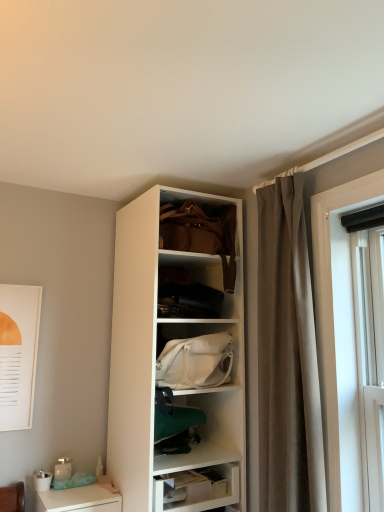
Question: Are white glossy desk at lower left and white fabric handbag at center, arranged as the 2th handbag when viewed from the top, located far from each other?

Choices:
 (A) no
 (B) yes

Answer: (A)

Question: Is white glossy desk at lower left positioned in front of white fabric handbag at center, arranged as the 2th handbag when viewed from the top?

Choices:
 (A) no
 (B) yes

Answer: (A)

Question: Is white glossy desk at lower left oriented towards white fabric handbag at center, the first handbag from the bottom?

Choices:
 (A) yes
 (B) no

Answer: (B)

Question: Considering the relative sizes of white glossy desk at lower left and white fabric handbag at center, the first handbag from the bottom, in the image provided, is white glossy desk at lower left wider than white fabric handbag at center, the first handbag from the bottom,?

Choices:
 (A) no
 (B) yes

Answer: (B)

Question: Is white glossy desk at lower left not within white fabric handbag at center, the first handbag from the bottom?

Choices:
 (A) no
 (B) yes

Answer: (B)

Question: From a real-world perspective, is white glossy desk at lower left positioned over white fabric handbag at center, the first handbag from the bottom, based on gravity?

Choices:
 (A) yes
 (B) no

Answer: (B)

Question: From a real-world perspective, is white fabric handbag at center, arranged as the 2th handbag when viewed from the top, physically below brown fabric curtain at right?

Choices:
 (A) no
 (B) yes

Answer: (B)

Question: From a real-world perspective, is white fabric handbag at center, the first handbag from the bottom, over brown fabric curtain at right?

Choices:
 (A) no
 (B) yes

Answer: (A)

Question: Considering the relative sizes of white fabric handbag at center, the first handbag from the bottom, and brown fabric curtain at right in the image provided, is white fabric handbag at center, the first handbag from the bottom, wider than brown fabric curtain at right?

Choices:
 (A) yes
 (B) no

Answer: (A)

Question: From the image's perspective, is white fabric handbag at center, the first handbag from the bottom, located above brown fabric curtain at right?

Choices:
 (A) no
 (B) yes

Answer: (A)

Question: Is white fabric handbag at center, the first handbag from the bottom, closer to the viewer compared to brown fabric curtain at right?

Choices:
 (A) no
 (B) yes

Answer: (A)

Question: Is white fabric handbag at center, the first handbag from the bottom, oriented towards brown fabric curtain at right?

Choices:
 (A) yes
 (B) no

Answer: (A)

Question: From a real-world perspective, is white fabric handbag at center, the first handbag from the bottom, over white glossy desk at lower left?

Choices:
 (A) no
 (B) yes

Answer: (B)